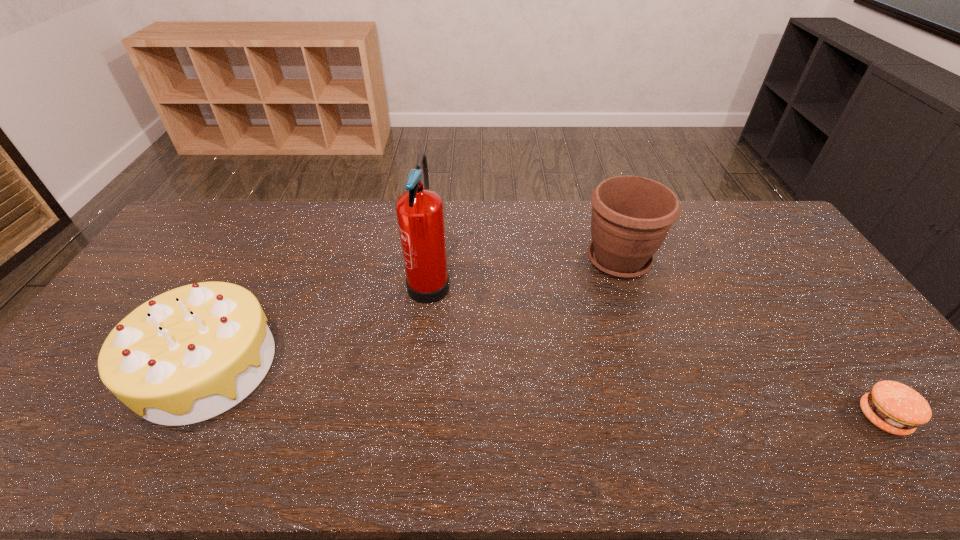
Find the location of a particular element. This screenshot has width=960, height=540. blank space at the far left corner is located at coordinates (197, 215).

You are a GUI agent. You are given a task and a screenshot of the screen. Output one action in this format:
    pyautogui.click(x=<x>, y=<y>)
    Task: Click on the vacant space that's between the second object from left to right and the second tallest object
    Image resolution: width=960 pixels, height=540 pixels.
    Given the screenshot: What is the action you would take?
    pyautogui.click(x=524, y=270)

Where is `free space between the patty and the third object from right to left`? Image resolution: width=960 pixels, height=540 pixels. free space between the patty and the third object from right to left is located at coordinates (657, 349).

Locate an element on the screen. free spot between the fire extinguisher and the patty is located at coordinates (657, 349).

Locate an element on the screen. free area in between the second object from right to left and the patty is located at coordinates (751, 339).

Identify the location of free space between the third object from right to left and the leftmost object. (318, 323).

Find the location of a particular element. The image size is (960, 540). free spot between the second shortest object and the rightmost object is located at coordinates (544, 392).

This screenshot has height=540, width=960. Identify the location of free area in between the fire extinguisher and the rightmost object. (657, 349).

This screenshot has height=540, width=960. Identify the location of vacant area between the tallest object and the third tallest object. (318, 323).

I want to click on unoccupied position between the second shortest object and the fire extinguisher, so click(318, 323).